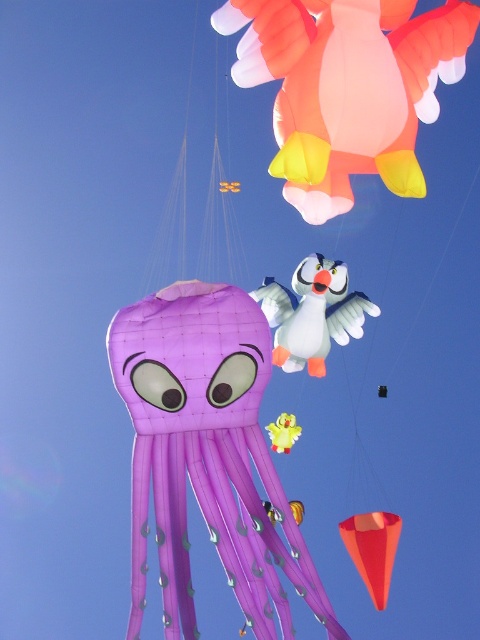
Question: Which point is farther to the camera?

Choices:
 (A) matte purple octopus at center
 (B) matte orange duck at upper center

Answer: (B)

Question: In this image, where is matte purple octopus at center located relative to matte orange cone at lower right?

Choices:
 (A) right
 (B) left

Answer: (B)

Question: Can you confirm if white glossy bird at center is thinner than matte orange cone at lower right?

Choices:
 (A) yes
 (B) no

Answer: (B)

Question: Can you confirm if matte purple octopus at center is positioned below matte orange duck at upper center?

Choices:
 (A) no
 (B) yes

Answer: (B)

Question: Which of the following is the farthest from the observer?

Choices:
 (A) matte purple octopus at center
 (B) matte orange duck at upper center
 (C) matte orange cone at lower right
 (D) white glossy bird at center

Answer: (D)

Question: Which point is farther to the camera?

Choices:
 (A) white glossy bird at center
 (B) matte purple octopus at center
 (C) matte orange duck at upper center
 (D) matte orange cone at lower right

Answer: (A)